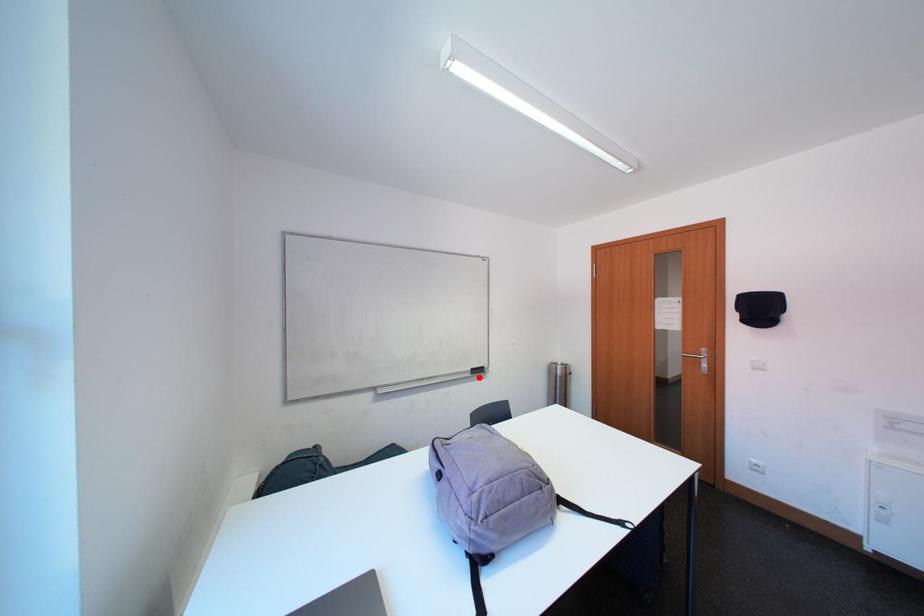
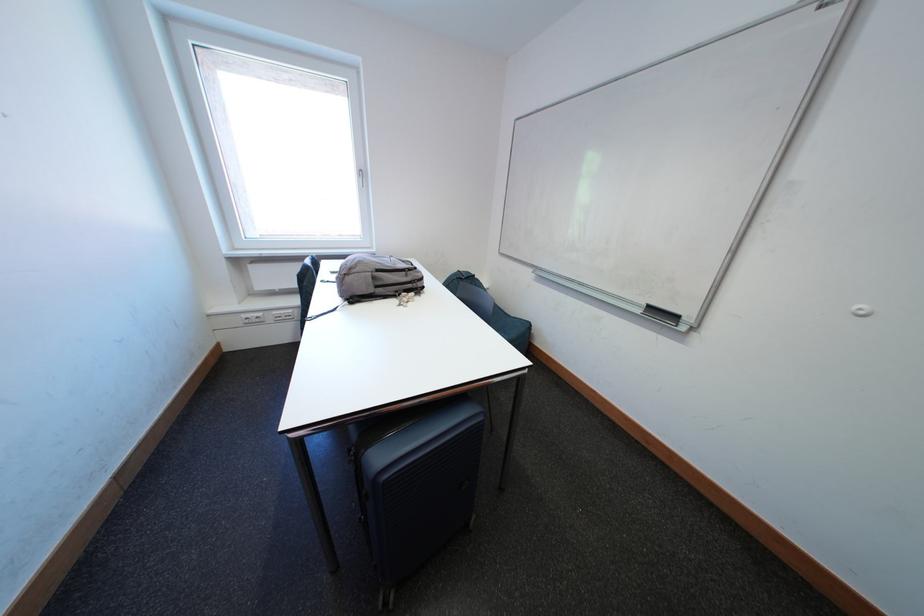
The point at the highlighted location is marked in the first image. Where is the corresponding point in the second image?

(649, 315)